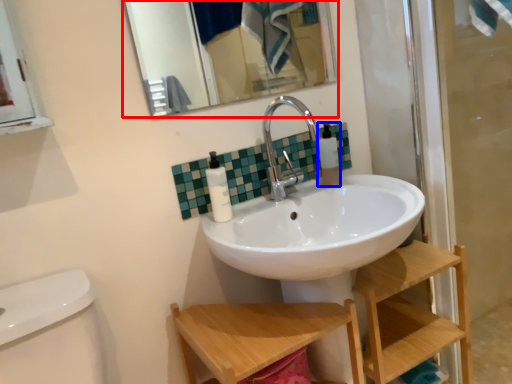
Question: Which of the following is the closest to the observer, mirror (highlighted by a red box) or toiletry (highlighted by a blue box)?

Choices:
 (A) mirror
 (B) toiletry

Answer: (A)